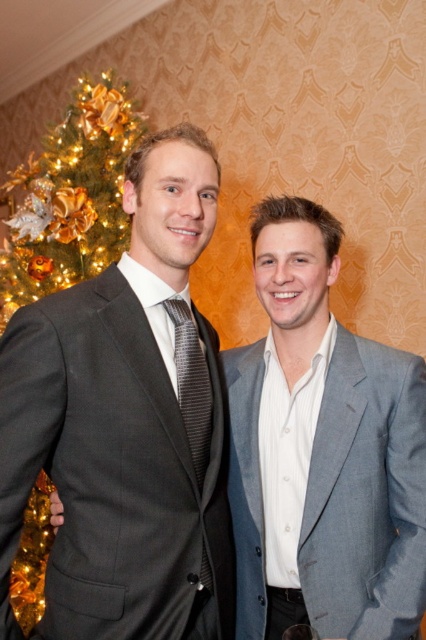
Question: Can you confirm if gray fabric suit at center is positioned above matte gray suit at left?

Choices:
 (A) yes
 (B) no

Answer: (A)

Question: Among these objects, which one is farthest from the camera?

Choices:
 (A) matte gray suit at left
 (B) black striped tie at center

Answer: (B)

Question: Which object is the closest to the shiny gold ornaments at left?

Choices:
 (A) matte gray suit at left
 (B) black striped tie at center

Answer: (B)

Question: Which of these objects is positioned closest to the gray fabric suit at center?

Choices:
 (A) matte gray suit at left
 (B) shiny gold ornaments at left
 (C) black striped tie at center

Answer: (C)

Question: From the image, what is the correct spatial relationship of gray fabric suit at center in relation to black striped tie at center?

Choices:
 (A) right
 (B) left

Answer: (A)

Question: Can you confirm if gray fabric suit at center is positioned to the left of shiny gold ornaments at left?

Choices:
 (A) yes
 (B) no

Answer: (B)